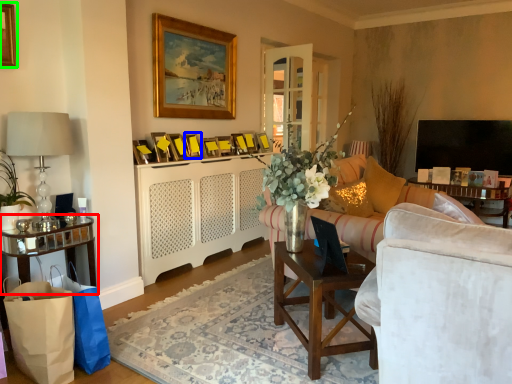
Question: Estimate the real-world distances between objects in this image. Which object is farther from table (highlighted by a red box), picture frame (highlighted by a blue box) or picture frame (highlighted by a green box)?

Choices:
 (A) picture frame
 (B) picture frame

Answer: (A)